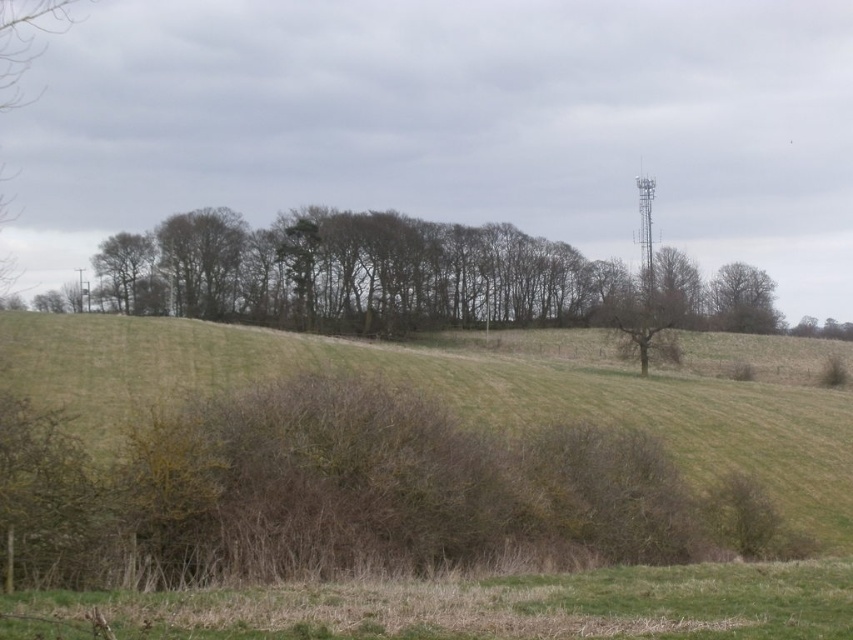
You are a hiker trying to estimate distances in the image. You notice the green grassy hillside at center and the brown textured tree at upper right. Which object occupies more horizontal space in the image?

The green grassy hillside at center occupies more horizontal space than the brown textured tree at upper right because its width surpasses the tree.

You are standing at the camera position looking at the rural landscape. There is a point marked at coordinates point (67, 394). Can you estimate how far this point is from your current position?

The point (67, 394) is 56.52 meters away from the camera, so the distance is approximately 56.52 meters.

You are standing in the rural landscape depicted in the image. You notice a point marked at coordinates (741, 300). What object does this point indicate?

The point at coordinates (741, 300) indicates the brown textured tree at upper right.